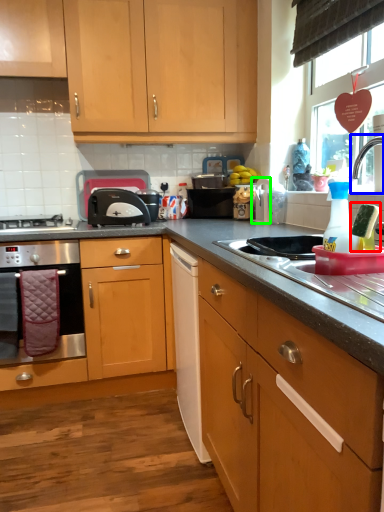
Question: Considering the real-world distances, which object is closest to appliance (highlighted by a red box)? tap (highlighted by a blue box) or appliance (highlighted by a green box).

Choices:
 (A) tap
 (B) appliance

Answer: (A)